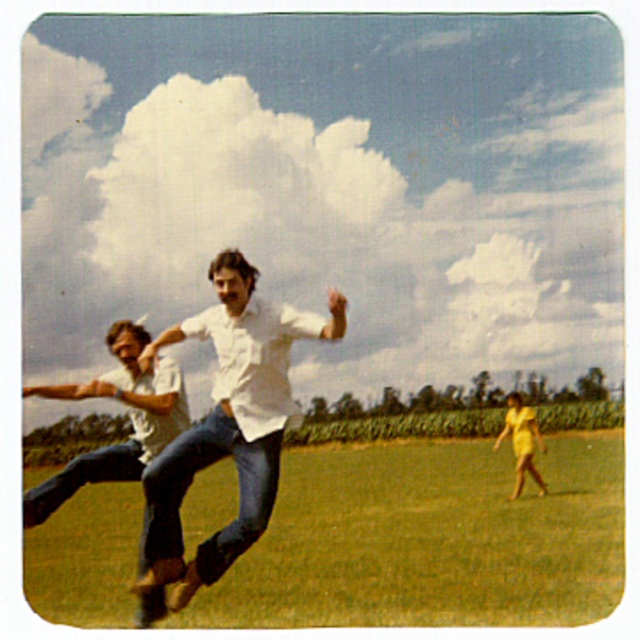
Is point (237, 253) more distant than point (508, 433)?

No, (237, 253) is closer to viewer.

Does white cotton shirt at center come behind yellow satin dress at lower right?

No.

Is point (234, 448) positioned before point (515, 440)?

Yes.

This screenshot has height=640, width=640. I want to click on white cotton shirt at center, so click(227, 424).

Looking at this image, who is more distant from viewer, (467, 477) or (531, 448)?

The point (467, 477) is more distant.

Can you confirm if green grass at center is wider than yellow satin dress at lower right?

Yes.

Locate an element on the screen. green grass at center is located at coordinates (429, 540).

I want to click on green grass at center, so click(x=429, y=540).

Which is above, green grass at center or light brown denim pants at left?

light brown denim pants at left is above.

Who is taller, green grass at center or light brown denim pants at left?

Standing taller between the two is green grass at center.

Who is more forward, (x=388, y=550) or (x=144, y=346)?

Point (x=144, y=346) is in front.

At what (x,y) coordinates should I click in order to perform the action: click on green grass at center. Please return your answer as a coordinate pair (x, y). The image size is (640, 640). Looking at the image, I should click on (429, 540).